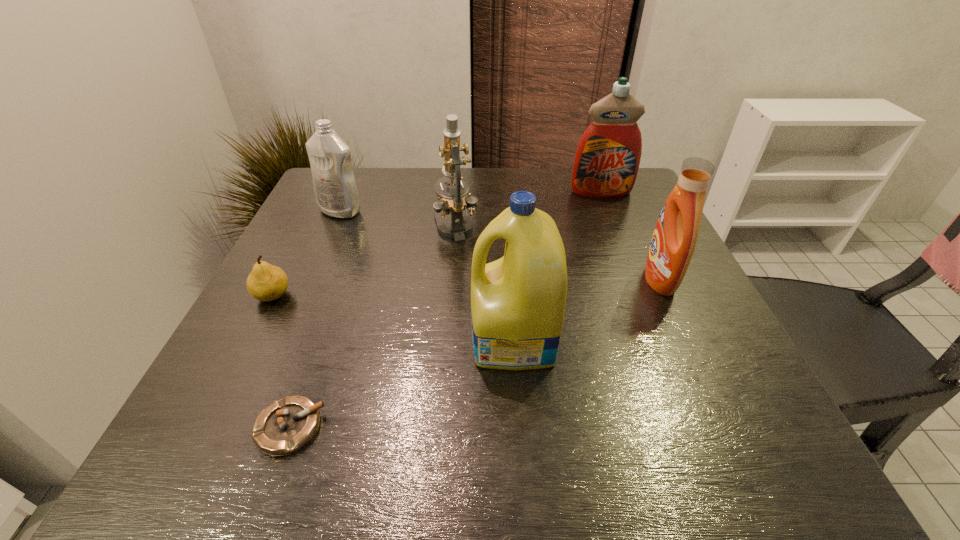
This screenshot has height=540, width=960. In the image, there is a desktop. Identify the location of free region at the right edge. (679, 309).

At what (x,y) coordinates should I click in order to perform the action: click on blank space at the far left corner of the desktop. Please return your answer as a coordinate pair (x, y). The image size is (960, 540). Looking at the image, I should click on (314, 200).

Where is `vacant area between the second shortest object and the nearest object`? vacant area between the second shortest object and the nearest object is located at coordinates (281, 362).

You are a GUI agent. You are given a task and a screenshot of the screen. Output one action in this format:
    pyautogui.click(x=<x>, y=<y>)
    Task: Click on the vacant area between the leftmost detergent and the ashtray
    The width and height of the screenshot is (960, 540).
    Given the screenshot: What is the action you would take?
    pyautogui.click(x=315, y=319)

Identify the location of vacant area that lies between the second shortest object and the third nearest detergent. (306, 253).

At what (x,y) coordinates should I click in order to perform the action: click on free spot between the nearest object and the second detergent from left to right. Please return your answer as a coordinate pair (x, y). This screenshot has width=960, height=540. Looking at the image, I should click on (401, 384).

This screenshot has width=960, height=540. What are the coordinates of `free space between the second farthest detergent and the shortest object` in the screenshot? It's located at (315, 319).

This screenshot has width=960, height=540. I want to click on empty space between the microscope and the third nearest detergent, so click(398, 219).

Find the location of a particular element. This screenshot has height=540, width=960. empty location between the second nearest detergent and the farthest object is located at coordinates (630, 236).

You are a GUI agent. You are given a task and a screenshot of the screen. Output one action in this format:
    pyautogui.click(x=<x>, y=<y>)
    Task: Click on the free space between the sixth tallest object and the third farthest detergent
    
    Given the screenshot: What is the action you would take?
    pyautogui.click(x=467, y=288)